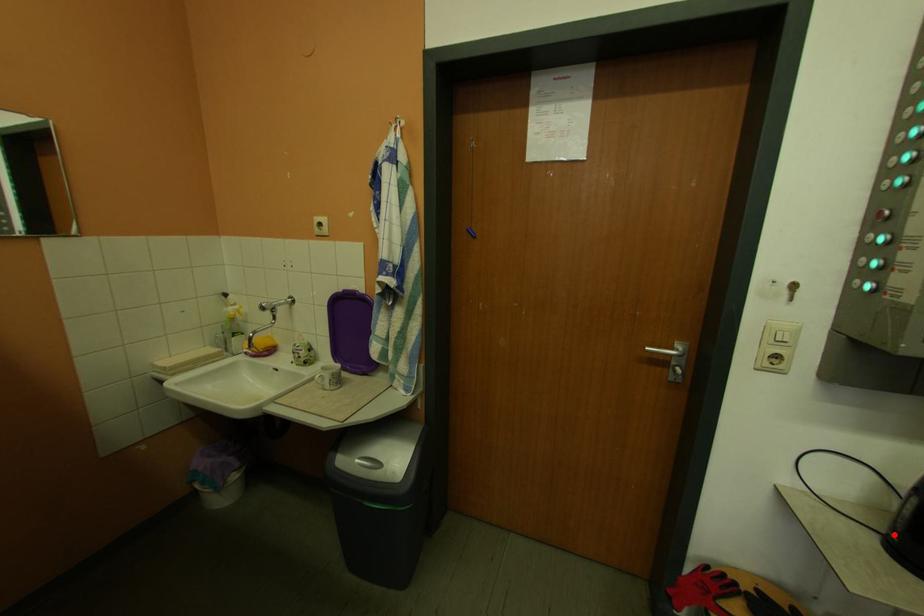
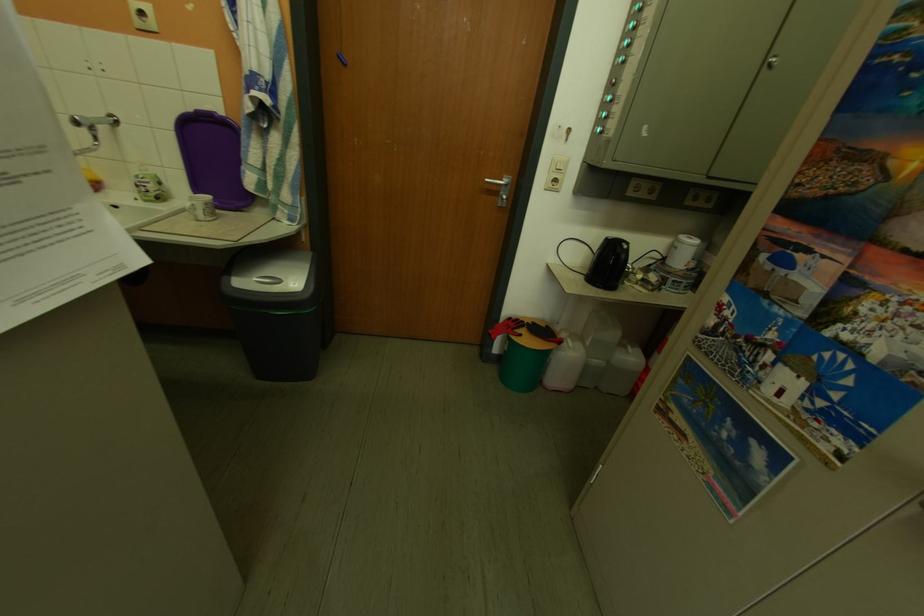
Find the pixel in the second image that matches the highlighted location in the first image.

(599, 277)